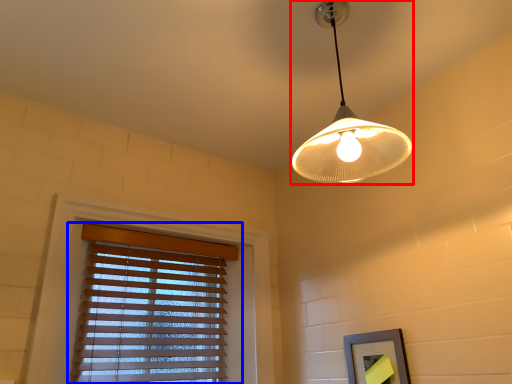
Question: Which object is closer to the camera taking this photo, lamp (highlighted by a red box) or window blind (highlighted by a blue box)?

Choices:
 (A) lamp
 (B) window blind

Answer: (A)